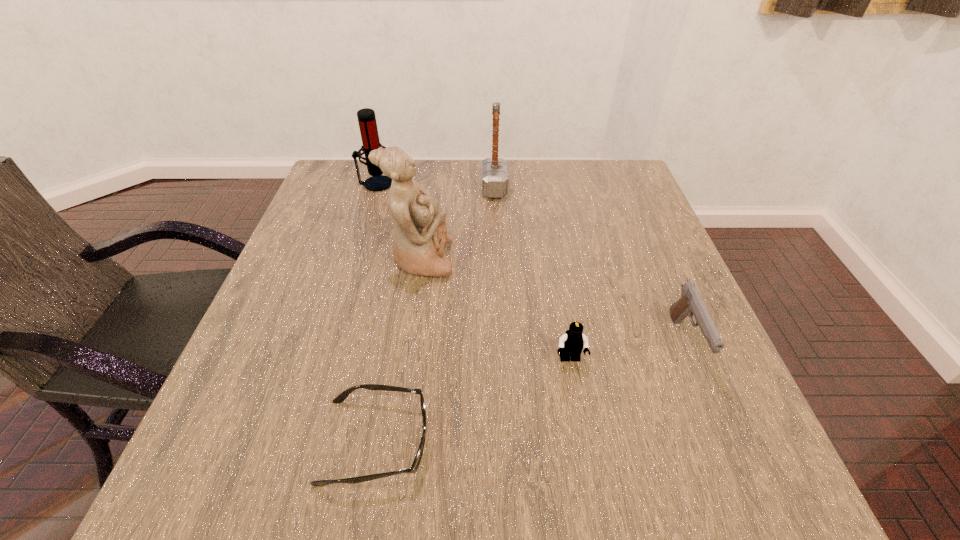
Find the location of a particular element. figurine is located at coordinates (420, 234).

Identify the location of hammer. (494, 170).

The image size is (960, 540). What are the coordinates of `microphone` in the screenshot? It's located at (366, 117).

Identify the location of the rightmost object. The image size is (960, 540). (690, 303).

Locate an element on the screen. the second object from right to left is located at coordinates (571, 344).

This screenshot has height=540, width=960. I want to click on spectacles, so click(x=340, y=398).

Where is `the nearest object`? the nearest object is located at coordinates (340, 398).

Locate an element on the screen. vacant space located 0.080m on the front-facing side of the figurine is located at coordinates (488, 259).

The image size is (960, 540). I want to click on vacant space positioned 0.270m on the striking surface of the fourth object from left to right, so click(x=385, y=188).

You are a GUI agent. You are given a task and a screenshot of the screen. Output one action in this format:
    pyautogui.click(x=<x>, y=<y>)
    Task: Click on the vacant space situated on the striking surface of the fourth object from left to right
    
    Given the screenshot: What is the action you would take?
    pyautogui.click(x=411, y=188)